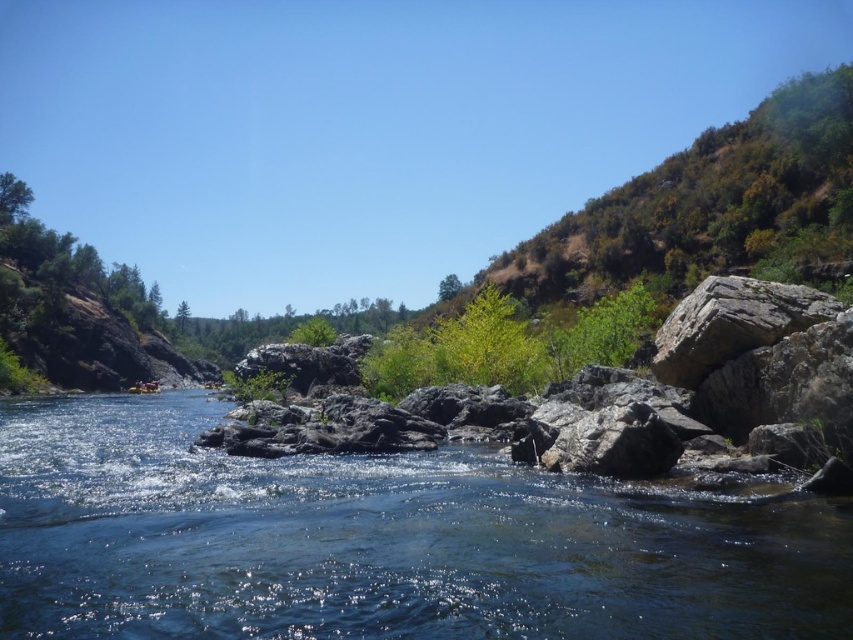
You are a hiker standing at the edge of the river and want to take a photo of the clear water at center and the green leafy tree at upper center. If your camera has a zoom lens that can focus up to 150 meters, will you be able to capture both subjects clearly in one shot?

The clear water at center is 140.76 meters away from the green leafy tree at upper center. Since your camera can focus up to 150 meters, you can capture both subjects clearly in one shot as the distance between them is within the camera range.